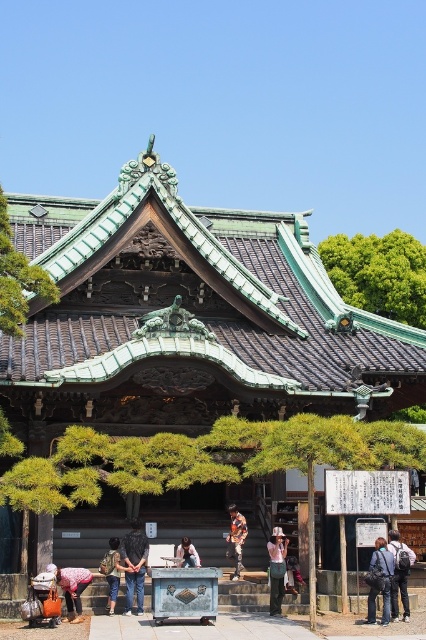
Question: Can you confirm if dark blue backpack at right is positioned to the left of light brown fabric jacket at center?

Choices:
 (A) yes
 (B) no

Answer: (B)

Question: Is matte brown pants at lower left to the right of camouflage jacket at center from the viewer's perspective?

Choices:
 (A) yes
 (B) no

Answer: (B)

Question: Considering the real-world distances, which object is closest to the denim jacket at lower right?

Choices:
 (A) wooden hat at center
 (B) camouflage jacket at center
 (C) light brown leather jacket at center

Answer: (A)

Question: Which point is closer to the camera?

Choices:
 (A) (284, 545)
 (B) (129, 609)
 (C) (57, 572)

Answer: (C)

Question: Based on their relative distances, which object is farther from the dark blue jeans at center?

Choices:
 (A) camouflage jacket at center
 (B) dark blue backpack at right

Answer: (B)

Question: Where is dark blue backpack at right located in relation to light brown leather jacket at center in the image?

Choices:
 (A) above
 (B) below

Answer: (A)